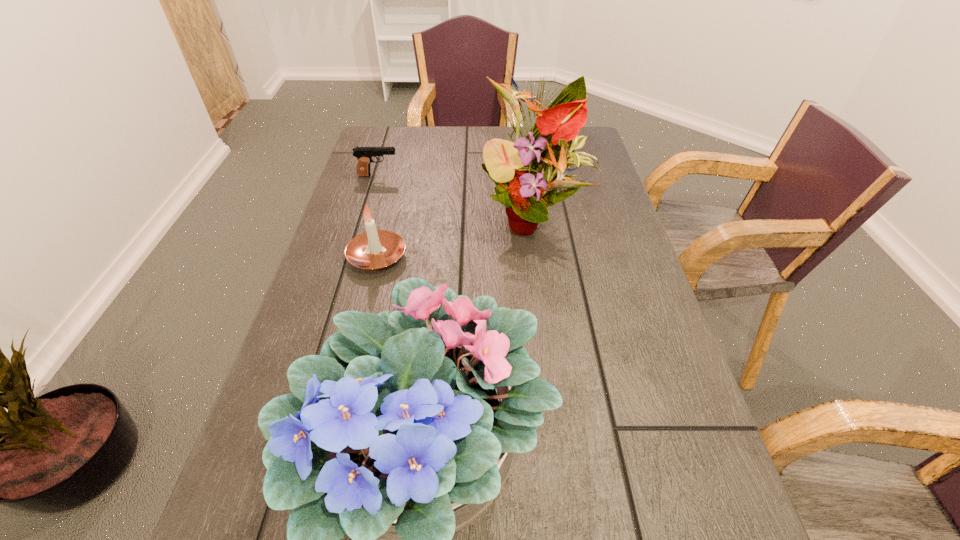
Locate an element on the screen. vacant space at the far edge is located at coordinates (420, 127).

The image size is (960, 540). Identify the location of vacant space at the left edge of the desktop. (321, 259).

The height and width of the screenshot is (540, 960). In order to click on vacant space at the right edge in this screenshot , I will do `click(665, 336)`.

Identify the location of free space between the pistol and the candle. This screenshot has height=540, width=960. point(377,216).

Image resolution: width=960 pixels, height=540 pixels. In order to click on blank region between the farthest object and the farther bouquet in this screenshot , I will do `click(455, 197)`.

Locate an element on the screen. Image resolution: width=960 pixels, height=540 pixels. vacant area that lies between the farthest object and the second shortest object is located at coordinates (377, 216).

The height and width of the screenshot is (540, 960). I want to click on free space between the farther bouquet and the farthest object, so click(x=455, y=197).

At what (x,y) coordinates should I click in order to perform the action: click on free space that is in between the farthest object and the second shortest object. Please return your answer as a coordinate pair (x, y). The image size is (960, 540). Looking at the image, I should click on (377, 216).

The image size is (960, 540). I want to click on object that is the third closest one to the nearer bouquet, so click(364, 155).

Select which object appears as the closest to the farther bouquet. Please provide its 2D coordinates. Your answer should be formatted as a tuple, i.e. [(x, y)], where the tuple contains the x and y coordinates of a point satisfying the conditions above.

[(374, 249)]